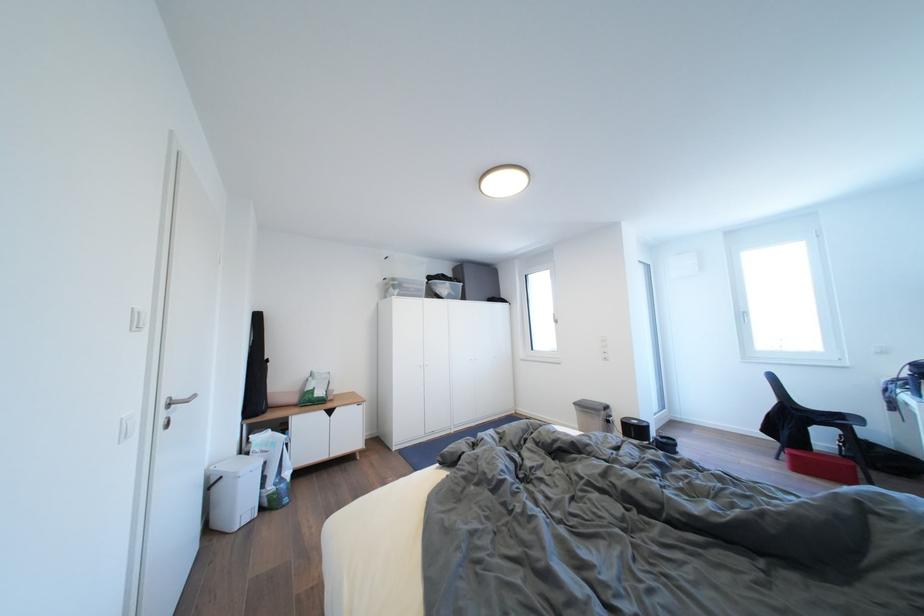
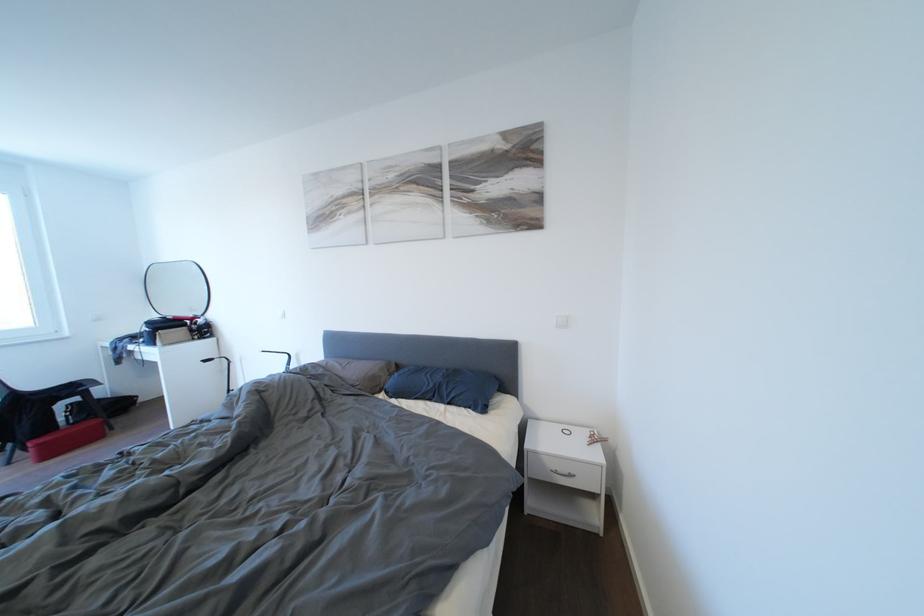
In the second image, find the point that corresponds to pixel 799 460 in the first image.

(46, 450)